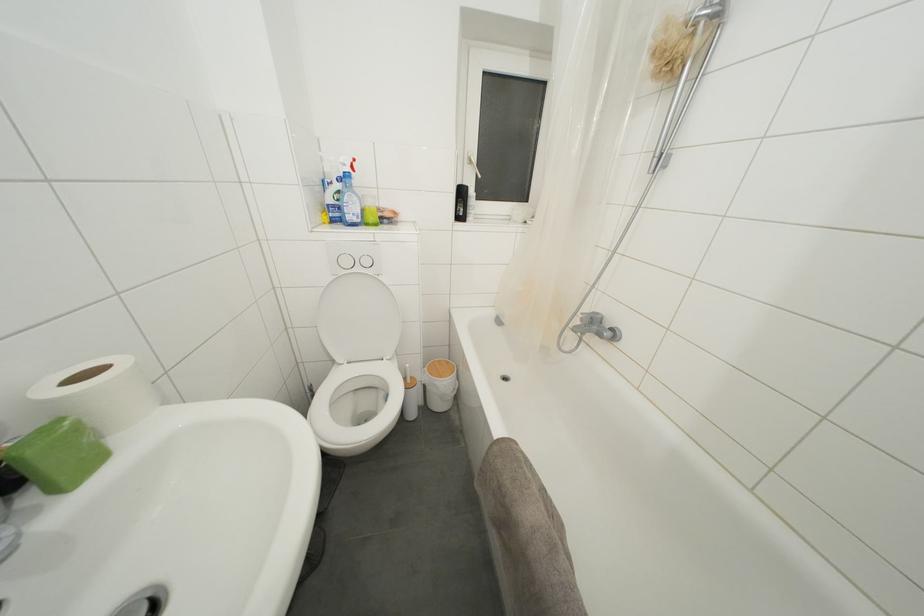
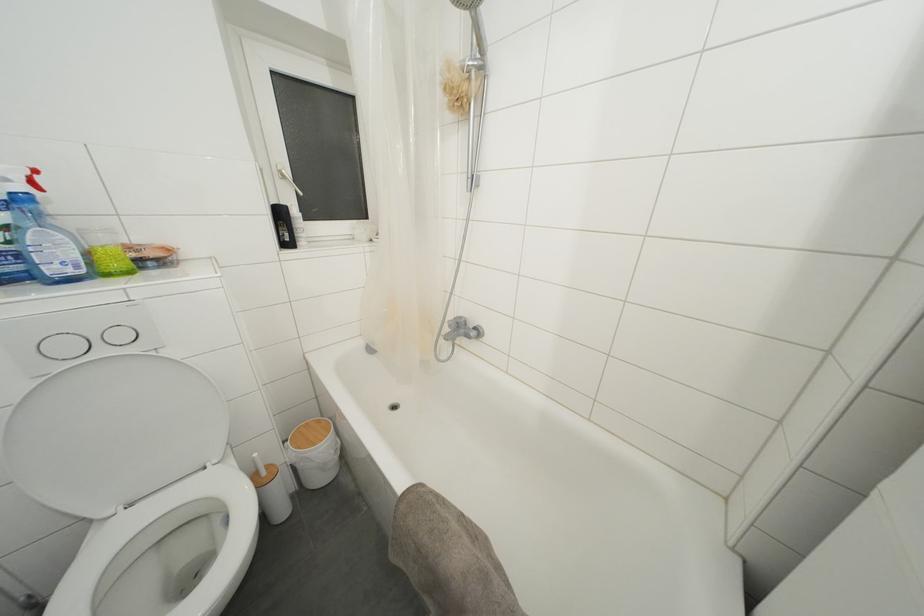
In the second image, find the point that corresponds to point (361, 274) in the first image.

(106, 357)